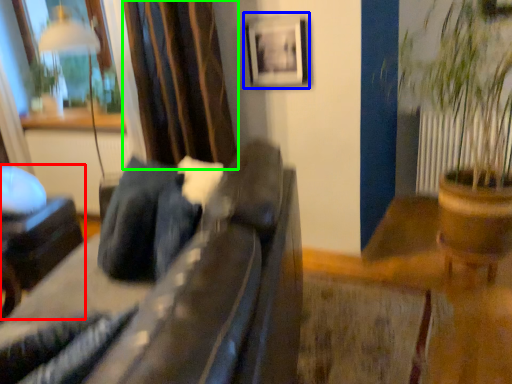
Question: Which object is positioned closest to furniture (highlighted by a red box)? Select from picture frame (highlighted by a blue box) and curtain (highlighted by a green box).

Choices:
 (A) picture frame
 (B) curtain

Answer: (B)